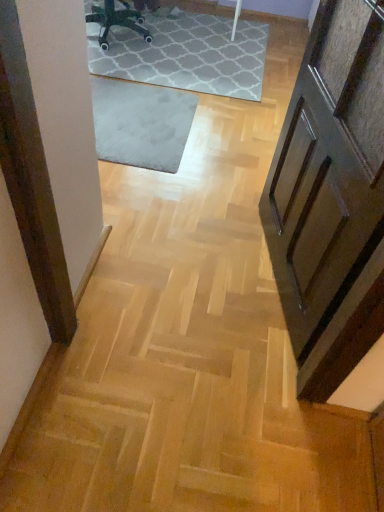
Locate an element on the screen. vacant space behind black plastic chair at upper center is located at coordinates (136, 30).